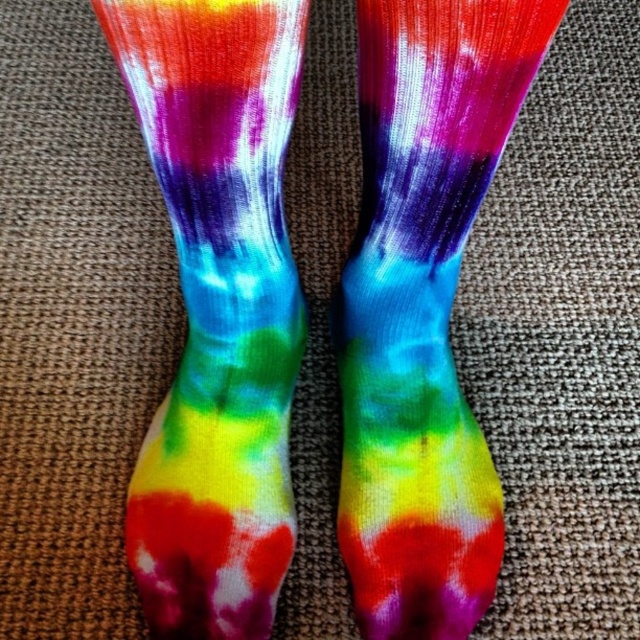
Which of these two, tie-dye fabric socks at center or rainbow tie-dye sock at center, stands shorter?

tie-dye fabric socks at center is shorter.

Is point (276, 502) positioned behind point (490, 497)?

No, it is in front of (490, 497).

Which is in front, point (259, 40) or point (380, 388)?

Positioned in front is point (259, 40).

Identify the location of tie-dye fabric socks at center. (218, 308).